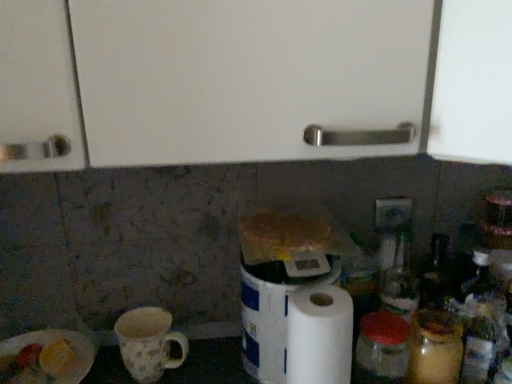
The height and width of the screenshot is (384, 512). Describe the element at coordinates (47, 357) in the screenshot. I see `white paper plate at lower left` at that location.

Where is `floral ceramic mug at lower left`? floral ceramic mug at lower left is located at coordinates click(x=148, y=343).

In terms of height, does floral ceramic mug at lower left look taller or shorter compared to white matte paper towel at center-right?

Considering their sizes, floral ceramic mug at lower left has less height than white matte paper towel at center-right.

From the image's perspective, which object appears higher, floral ceramic mug at lower left or white matte paper towel at center-right?

From the image's view, white matte paper towel at center-right is above.

Consider the image. Considering the positions of objects floral ceramic mug at lower left and white matte paper towel at center-right in the image provided, who is more to the right, floral ceramic mug at lower left or white matte paper towel at center-right?

From the viewer's perspective, white matte paper towel at center-right appears more on the right side.

Would you say green plastic electric outlet at upper right is to the left or to the right of floral ceramic mug at lower left in the picture?

Clearly, green plastic electric outlet at upper right is on the right of floral ceramic mug at lower left in the image.

Is green plastic electric outlet at upper right behind floral ceramic mug at lower left?

Yes, green plastic electric outlet at upper right is further from the viewer.

From a real-world perspective, which is physically below, green plastic electric outlet at upper right or floral ceramic mug at lower left?

floral ceramic mug at lower left.

Does point (132, 376) lie in front of point (265, 314)?

No, (132, 376) is behind (265, 314).

Does floral ceramic mug at lower left appear on the right side of white paper towel at center?

No.

In terms of width, does floral ceramic mug at lower left look wider or thinner when compared to white paper towel at center?

In the image, floral ceramic mug at lower left appears to be more narrow than white paper towel at center.

Are white paper towel at center and white matte paper towel at center-right far apart?

They are positioned close to each other.

Does white paper towel at center have a lesser width compared to white matte paper towel at center-right?

In fact, white paper towel at center might be wider than white matte paper towel at center-right.

Does point (250, 366) come behind point (298, 313)?

Yes, point (250, 366) is behind point (298, 313).

What's the angular difference between white paper towel at center and white matte paper towel at center-right's facing directions?

They differ by 0.00136 degrees in their facing directions.

Which of these two, white paper plate at lower left or green plastic electric outlet at upper right, stands taller?

green plastic electric outlet at upper right.

Between white paper plate at lower left and green plastic electric outlet at upper right, which one appears on the right side from the viewer's perspective?

green plastic electric outlet at upper right is more to the right.

Does white paper plate at lower left have a smaller size compared to green plastic electric outlet at upper right?

Actually, white paper plate at lower left might be larger than green plastic electric outlet at upper right.

Considering the points (45, 341) and (379, 230), which point is behind, point (45, 341) or point (379, 230)?

The point (379, 230) is farther from the camera.

From their relative heights in the image, would you say white matte paper towel at center-right is taller or shorter than white paper plate at lower left?

Clearly, white matte paper towel at center-right is taller compared to white paper plate at lower left.

Can you tell me how much white matte paper towel at center-right and white paper plate at lower left differ in facing direction?

0.000212 degrees separate the facing orientations of white matte paper towel at center-right and white paper plate at lower left.

Could you tell me if white matte paper towel at center-right is facing white paper plate at lower left?

No, white matte paper towel at center-right is not aimed at white paper plate at lower left.

Is white matte paper towel at center-right behind white paper plate at lower left?

That is False.

Based on the photo, from the image's perspective, is green plastic electric outlet at upper right located above white matte paper towel at center-right?

Yes.

Considering the sizes of green plastic electric outlet at upper right and white matte paper towel at center-right in the image, is green plastic electric outlet at upper right bigger or smaller than white matte paper towel at center-right?

In the image, green plastic electric outlet at upper right appears to be smaller than white matte paper towel at center-right.

Is green plastic electric outlet at upper right far away from white matte paper towel at center-right?

green plastic electric outlet at upper right is actually quite close to white matte paper towel at center-right.

Does green plastic electric outlet at upper right appear on the left side of white matte paper towel at center-right?

No.

You are a GUI agent. You are given a task and a screenshot of the screen. Output one action in this format:
    pyautogui.click(x=<x>, y=<y>)
    Task: Click on the mug located behind the white matte paper towel at center-right
    
    Given the screenshot: What is the action you would take?
    pyautogui.click(x=148, y=343)

This screenshot has width=512, height=384. What are the coordinates of `electric outlet above the floral ceramic mug at lower left (from the image's perspective)` in the screenshot? It's located at (392, 213).

In the scene shown: Looking at the image, which one is located further to white paper plate at lower left, floral ceramic mug at lower left or white paper towel at center?

white paper towel at center is positioned further to the anchor white paper plate at lower left.

Estimate the real-world distances between objects in this image. Which object is closer to white paper towel at center, white matte paper towel at center-right or white paper plate at lower left?

Based on the image, white matte paper towel at center-right appears to be nearer to white paper towel at center.

Estimate the real-world distances between objects in this image. Which object is closer to floral ceramic mug at lower left, white paper towel at center or white paper plate at lower left?

The object closer to floral ceramic mug at lower left is white paper plate at lower left.

Which object lies further to the anchor point white matte paper towel at center-right, white paper towel at center or floral ceramic mug at lower left?

Among the two, floral ceramic mug at lower left is located further to white matte paper towel at center-right.

When comparing their distances from white matte paper towel at center-right, does floral ceramic mug at lower left or white paper towel at center seem further?

Among the two, floral ceramic mug at lower left is located further to white matte paper towel at center-right.

Which object lies further to the anchor point white paper plate at lower left, white paper towel at center or white matte paper towel at center-right?

white matte paper towel at center-right is further to white paper plate at lower left.

Based on their spatial positions, is green plastic electric outlet at upper right or floral ceramic mug at lower left further from white paper towel at center?

The object further to white paper towel at center is green plastic electric outlet at upper right.

Based on their spatial positions, is white paper towel at center or floral ceramic mug at lower left further from green plastic electric outlet at upper right?

Based on the image, floral ceramic mug at lower left appears to be further to green plastic electric outlet at upper right.

Find the location of `mug located between white paper plate at lower left and white matte paper towel at center-right in the left-right direction`. mug located between white paper plate at lower left and white matte paper towel at center-right in the left-right direction is located at coordinates (148, 343).

At what (x,y) coordinates should I click in order to perform the action: click on appliance between white paper plate at lower left and green plastic electric outlet at upper right. Please return your answer as a coordinate pair (x, y). Image resolution: width=512 pixels, height=384 pixels. Looking at the image, I should click on (271, 315).

Locate an element on the screen. The image size is (512, 384). paper towel between floral ceramic mug at lower left and green plastic electric outlet at upper right from left to right is located at coordinates (319, 336).

This screenshot has width=512, height=384. I want to click on paper towel between white paper plate at lower left and green plastic electric outlet at upper right, so click(x=319, y=336).